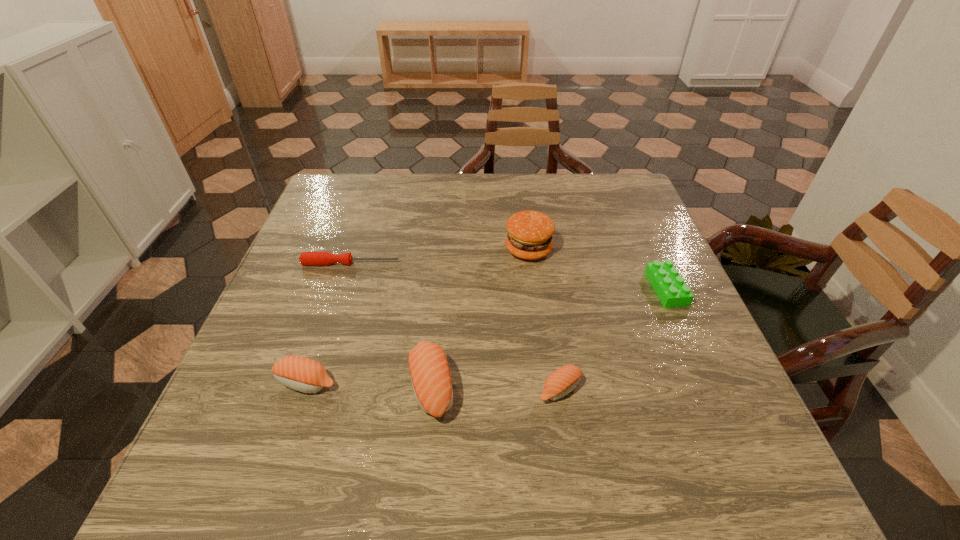
Please point a spot to add another sushi on the right. Please provide its 2D coordinates. Your answer should be formatted as a tuple, i.e. [(x, y)], where the tuple contains the x and y coordinates of a point satisfying the conditions above.

[(689, 393)]